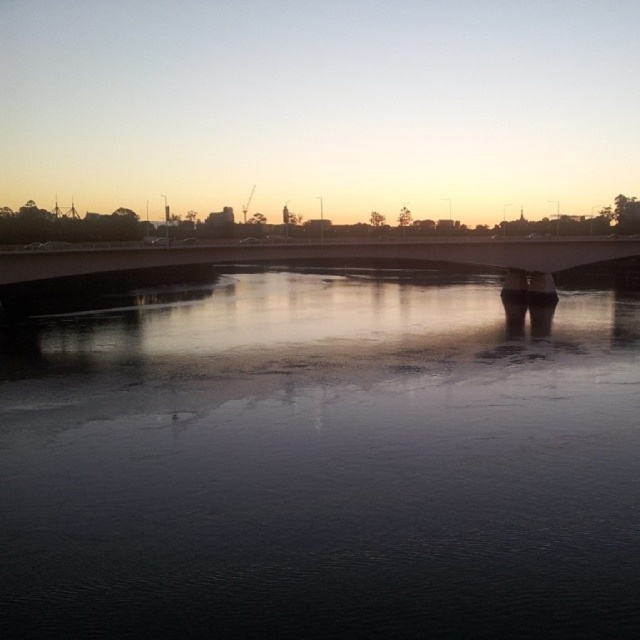
Question: From the image, what is the correct spatial relationship of dark reflective water at center in relation to white concrete bridge at center?

Choices:
 (A) above
 (B) below

Answer: (B)

Question: Among these objects, which one is farthest from the camera?

Choices:
 (A) white concrete bridge at center
 (B) dark reflective water at center

Answer: (A)

Question: Is dark reflective water at center positioned before white concrete bridge at center?

Choices:
 (A) yes
 (B) no

Answer: (A)

Question: Does dark reflective water at center have a lesser width compared to white concrete bridge at center?

Choices:
 (A) no
 (B) yes

Answer: (A)